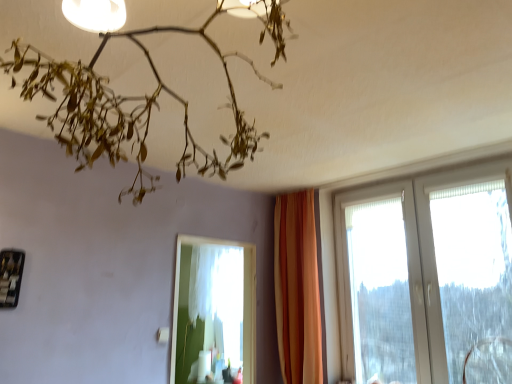
Question: Is white plastic window at right at the right side of white sheer curtain at center?

Choices:
 (A) no
 (B) yes

Answer: (B)

Question: Is white plastic window at right smaller than white sheer curtain at center?

Choices:
 (A) yes
 (B) no

Answer: (B)

Question: From the image's perspective, is white plastic window at right above white sheer curtain at center?

Choices:
 (A) no
 (B) yes

Answer: (B)

Question: Is white plastic window at right further to camera compared to white sheer curtain at center?

Choices:
 (A) no
 (B) yes

Answer: (A)

Question: Can you confirm if white plastic window at right is thinner than white sheer curtain at center?

Choices:
 (A) yes
 (B) no

Answer: (B)

Question: Can you confirm if white plastic window at right is taller than white sheer curtain at center?

Choices:
 (A) yes
 (B) no

Answer: (A)

Question: Is orange fabric curtain at center shorter than metallic black picture frame at lower left?

Choices:
 (A) yes
 (B) no

Answer: (B)

Question: From a real-world perspective, is orange fabric curtain at center positioned over metallic black picture frame at lower left based on gravity?

Choices:
 (A) yes
 (B) no

Answer: (B)

Question: Is orange fabric curtain at center oriented away from metallic black picture frame at lower left?

Choices:
 (A) no
 (B) yes

Answer: (A)

Question: Is orange fabric curtain at center taller than metallic black picture frame at lower left?

Choices:
 (A) no
 (B) yes

Answer: (B)

Question: From a real-world perspective, is orange fabric curtain at center below metallic black picture frame at lower left?

Choices:
 (A) no
 (B) yes

Answer: (B)

Question: Is orange fabric curtain at center behind metallic black picture frame at lower left?

Choices:
 (A) yes
 (B) no

Answer: (A)

Question: Is transparent plastic swivel chair at lower right positioned behind white sheer curtain at center?

Choices:
 (A) no
 (B) yes

Answer: (A)